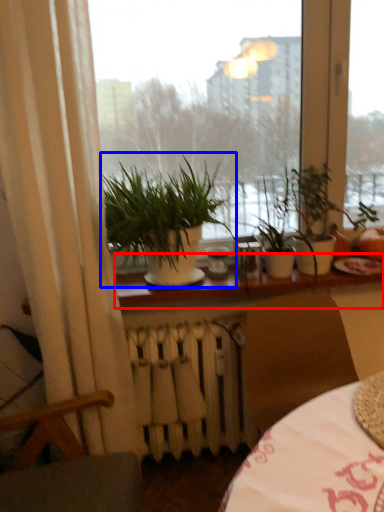
Question: Which object appears farthest to the camera in this image, window sill (highlighted by a red box) or houseplant (highlighted by a blue box)?

Choices:
 (A) window sill
 (B) houseplant

Answer: (A)